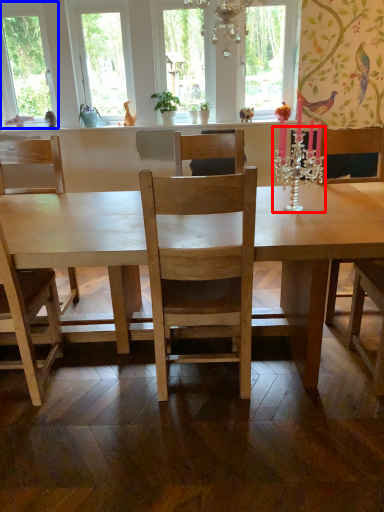
Question: Which of the following is the farthest to the observer, candle holder (highlighted by a red box) or window (highlighted by a blue box)?

Choices:
 (A) candle holder
 (B) window

Answer: (B)